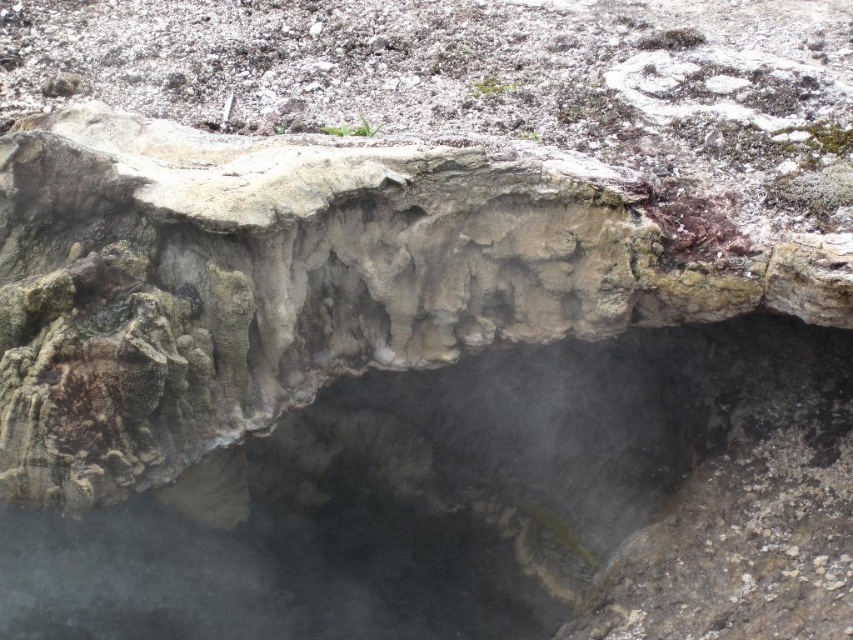
Does smoke-like water at center appear on the right side of rough stone cave at center?

Correct, you'll find smoke-like water at center to the right of rough stone cave at center.

Does smoke-like water at center appear under rough stone cave at center?

Correct, smoke-like water at center is located below rough stone cave at center.

Locate an element on the screen. Image resolution: width=853 pixels, height=640 pixels. smoke-like water at center is located at coordinates (497, 506).